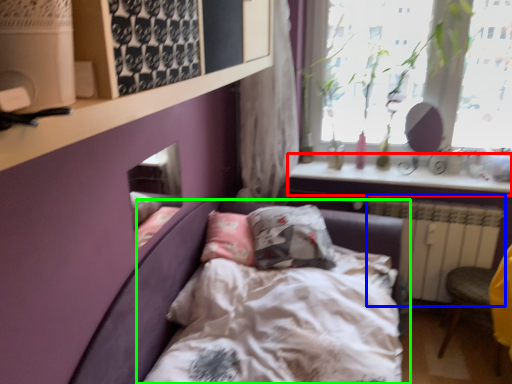
Question: Which object is positioned farthest from window sill (highlighted by a red box)? Select from radiator (highlighted by a blue box) and bed (highlighted by a green box).

Choices:
 (A) radiator
 (B) bed

Answer: (B)